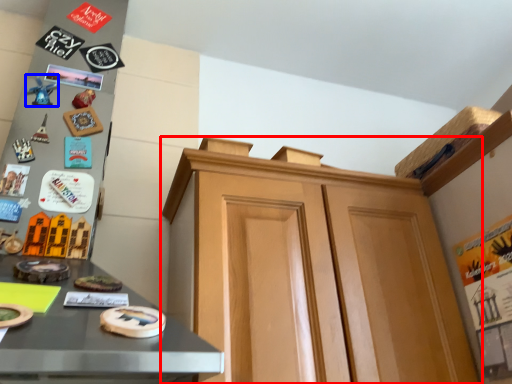
Question: Which object is further to the camera taking this photo, cabinetry (highlighted by a red box) or toy (highlighted by a blue box)?

Choices:
 (A) cabinetry
 (B) toy

Answer: (B)